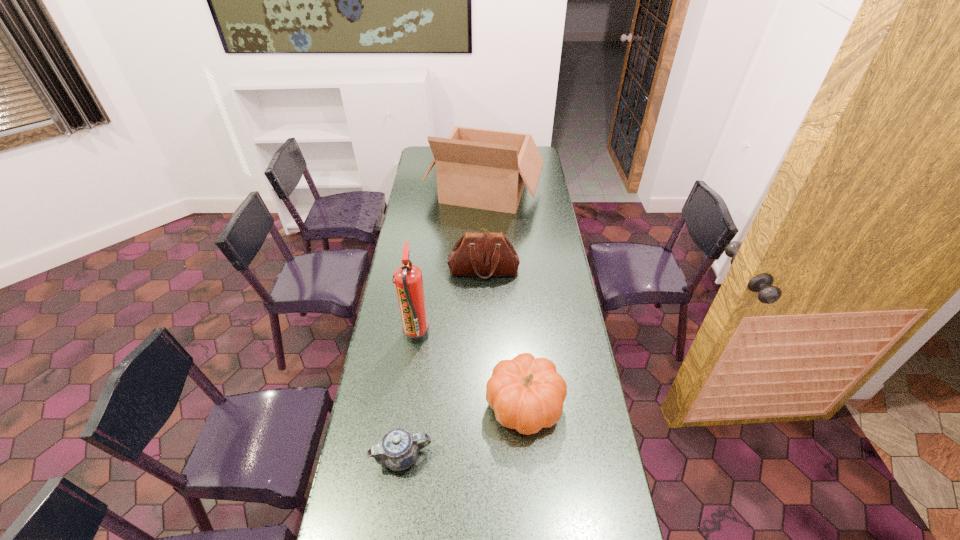
Locate an element on the screen. The width and height of the screenshot is (960, 540). the farthest object is located at coordinates (486, 169).

Identify the location of fire extinguisher. The image size is (960, 540). (408, 278).

The image size is (960, 540). Identify the location of the fourth nearest object. (484, 254).

Locate an element on the screen. The width and height of the screenshot is (960, 540). the third tallest object is located at coordinates (x=484, y=254).

You are a GUI agent. You are given a task and a screenshot of the screen. Output one action in this format:
    pyautogui.click(x=<x>, y=<y>)
    Task: Click on the pumpkin
    The height and width of the screenshot is (540, 960).
    Given the screenshot: What is the action you would take?
    pyautogui.click(x=527, y=394)

Where is `chinaware`? This screenshot has height=540, width=960. chinaware is located at coordinates [398, 449].

This screenshot has width=960, height=540. In order to click on vacant area situated on the front of the box in this screenshot , I will do `click(486, 250)`.

This screenshot has width=960, height=540. In order to click on vacant space located 0.380m with the nozzle pointing from the back of the fire extinguisher in this screenshot , I will do `click(530, 335)`.

You are a GUI agent. You are given a task and a screenshot of the screen. Output one action in this format:
    pyautogui.click(x=<x>, y=<y>)
    Task: Click on the vacant space located on the right of the shoulder bag
    
    Given the screenshot: What is the action you would take?
    pyautogui.click(x=540, y=270)

At what (x,y) coordinates should I click in order to perform the action: click on vacant space positioned 0.170m on the back of the pumpkin. Please return your answer as a coordinate pair (x, y). Looking at the image, I should click on (518, 334).